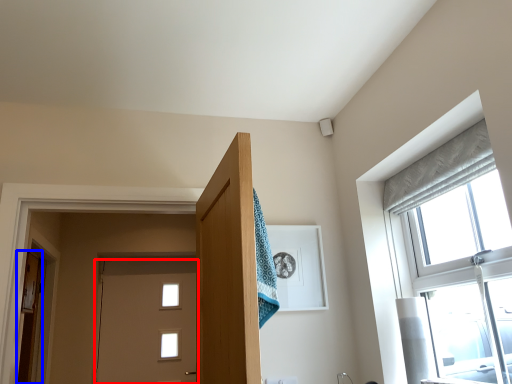
Question: Which object appears closest to the camera in this image, door (highlighted by a red box) or door (highlighted by a blue box)?

Choices:
 (A) door
 (B) door

Answer: (B)